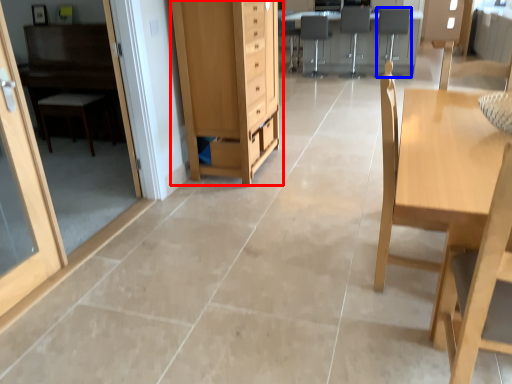
Question: Which of the following is the closest to the observer, cabinetry (highlighted by a red box) or armchair (highlighted by a blue box)?

Choices:
 (A) cabinetry
 (B) armchair

Answer: (A)